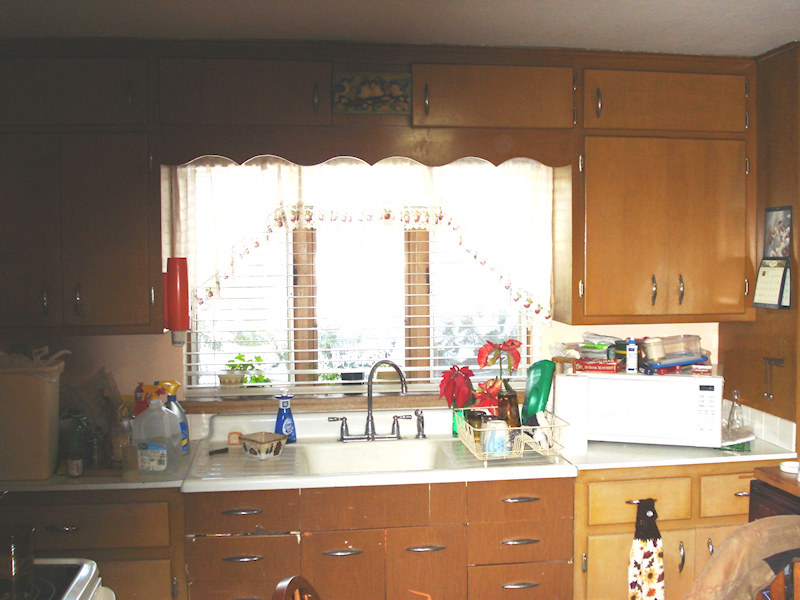
I want to click on square bowl, so click(264, 445).